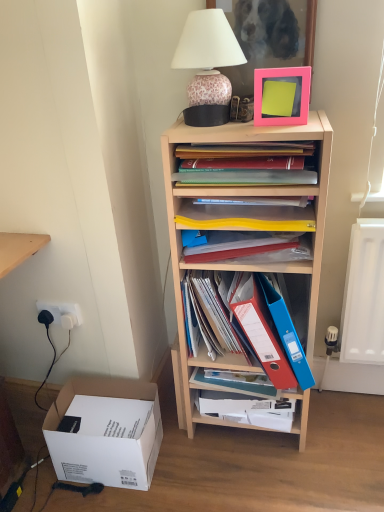
Question: Is matte blue folder at center, marked as the 1th book in a bottom-to-top arrangement, spatially inside wooden shelf at center, or outside of it?

Choices:
 (A) outside
 (B) inside

Answer: (B)

Question: Considering their positions, is matte blue folder at center, marked as the 1th book in a bottom-to-top arrangement, located in front of or behind wooden shelf at center?

Choices:
 (A) front
 (B) behind

Answer: (B)

Question: Which object is the farthest from the matte plastic folders at upper center, which is the first book from top to bottom?

Choices:
 (A) pink matte picture frame at upper center, marked as the second picture frame in a top-to-bottom arrangement
 (B) white plastic power outlet at lower left
 (C) white cardboard box at lower left
 (D) blue plastic folder at center right, the first paperback book in the right-to-left sequence
 (E) yellow plastic magazine at center

Answer: (C)

Question: Estimate the real-world distances between objects in this image. Which object is closer to the matte plastic folders at center, which is counted as the second book, starting from the top?

Choices:
 (A) wooden shelf at center
 (B) white plastic power outlet at lower left
 (C) blue plastic folder at center right, positioned as the second paperback book in left-to-right order
 (D) matte plastic folder at center, the 2th paperback book viewed from the right
 (E) pink matte picture frame at upper center, arranged as the 2th picture frame when ordered from the bottom

Answer: (D)